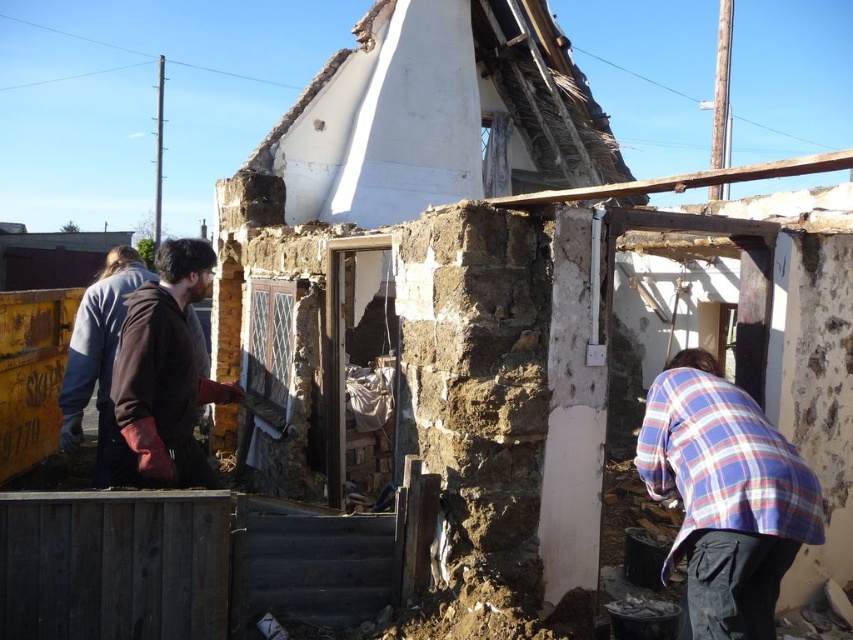
Question: Considering the relative positions of plaid fabric shirt at lower right and brown leather jacket at left in the image provided, where is plaid fabric shirt at lower right located with respect to brown leather jacket at left?

Choices:
 (A) right
 (B) left

Answer: (A)

Question: Which point is farther to the camera?

Choices:
 (A) coord(746,616)
 (B) coord(96,372)

Answer: (B)

Question: Does plaid fabric shirt at lower right appear over dark blue jacket at left?

Choices:
 (A) yes
 (B) no

Answer: (B)

Question: Which object is farther from the camera taking this photo?

Choices:
 (A) plaid fabric shirt at lower right
 (B) dark blue jacket at left

Answer: (B)

Question: Which point appears closest to the camera in this image?

Choices:
 (A) (759, 492)
 (B) (115, 326)
 (C) (189, 260)

Answer: (A)

Question: Is plaid fabric shirt at lower right to the left of brown leather jacket at left from the viewer's perspective?

Choices:
 (A) no
 (B) yes

Answer: (A)